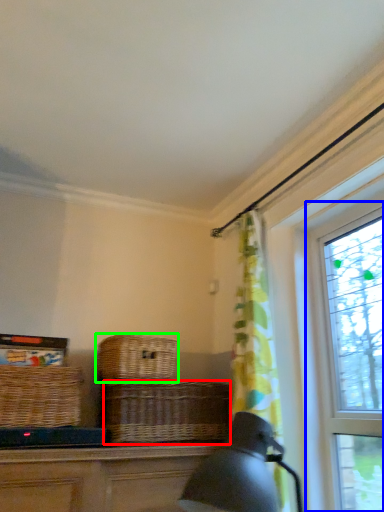
Question: Estimate the real-world distances between objects in this image. Which object is closer to basket (highlighted by a red box), window (highlighted by a blue box) or picnic basket (highlighted by a green box)?

Choices:
 (A) window
 (B) picnic basket

Answer: (B)